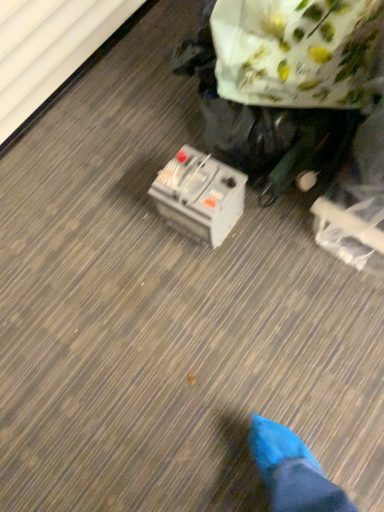
Question: Can you confirm if gray plastic battery at center is shorter than white floral paper bag at upper right?

Choices:
 (A) no
 (B) yes

Answer: (B)

Question: Is gray plastic battery at center positioned beyond the bounds of white floral paper bag at upper right?

Choices:
 (A) yes
 (B) no

Answer: (A)

Question: Is gray plastic battery at center at the left side of white floral paper bag at upper right?

Choices:
 (A) yes
 (B) no

Answer: (A)

Question: Is gray plastic battery at center in contact with white floral paper bag at upper right?

Choices:
 (A) yes
 (B) no

Answer: (B)

Question: From a real-world perspective, is gray plastic battery at center physically below white floral paper bag at upper right?

Choices:
 (A) no
 (B) yes

Answer: (B)

Question: From the image's perspective, does gray plastic battery at center appear lower than white floral paper bag at upper right?

Choices:
 (A) no
 (B) yes

Answer: (B)

Question: Is white floral paper bag at upper right taller than gray plastic battery at center?

Choices:
 (A) yes
 (B) no

Answer: (A)

Question: Is white floral paper bag at upper right shorter than gray plastic battery at center?

Choices:
 (A) yes
 (B) no

Answer: (B)

Question: Is white floral paper bag at upper right positioned before gray plastic battery at center?

Choices:
 (A) no
 (B) yes

Answer: (B)

Question: From a real-world perspective, is white floral paper bag at upper right positioned over gray plastic battery at center based on gravity?

Choices:
 (A) yes
 (B) no

Answer: (A)

Question: Can you confirm if white floral paper bag at upper right is bigger than gray plastic battery at center?

Choices:
 (A) yes
 (B) no

Answer: (A)

Question: From the image's perspective, is white floral paper bag at upper right above gray plastic battery at center?

Choices:
 (A) yes
 (B) no

Answer: (A)

Question: Relative to gray plastic battery at center, is white floral paper bag at upper right in front or behind?

Choices:
 (A) behind
 (B) front

Answer: (B)